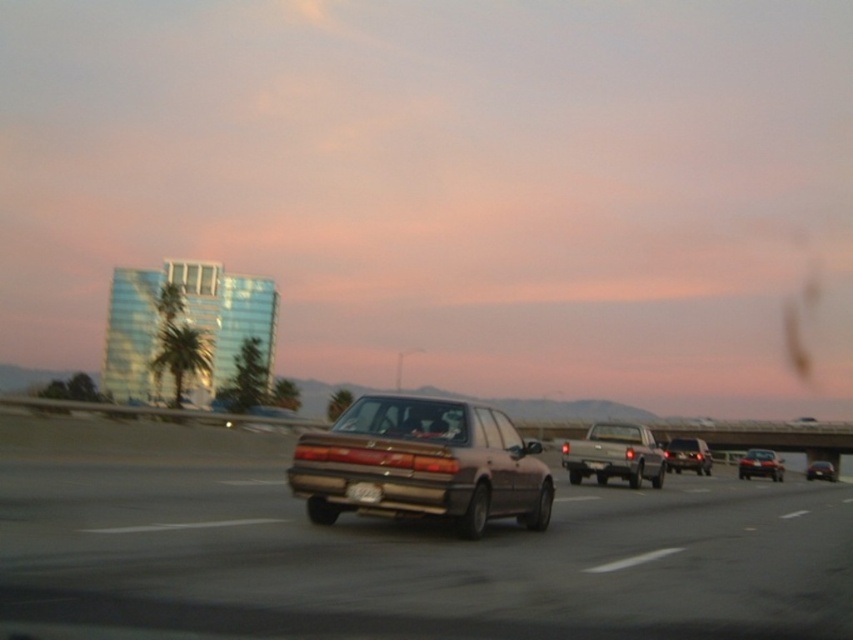
Can you confirm if green leafy palm tree at left is positioned below shiny silver sedan at lower right?

Incorrect, green leafy palm tree at left is not positioned below shiny silver sedan at lower right.

Image resolution: width=853 pixels, height=640 pixels. What do you see at coordinates (180, 355) in the screenshot? I see `green leafy palm tree at left` at bounding box center [180, 355].

Does point (184, 371) lie in front of point (762, 468)?

No, it is behind (762, 468).

Identify the location of green leafy palm tree at left. The image size is (853, 640). (180, 355).

From the picture: Is metallic brown car at center bigger than shiny silver sedan at lower right?

Actually, metallic brown car at center might be smaller than shiny silver sedan at lower right.

Does metallic brown car at center have a greater height compared to shiny silver sedan at lower right?

In fact, metallic brown car at center may be shorter than shiny silver sedan at lower right.

Find the location of a particular element. This screenshot has height=640, width=853. metallic brown car at center is located at coordinates (418, 561).

Is matte gray sedan at center wider than shiny silver sedan at lower right?

No, matte gray sedan at center is not wider than shiny silver sedan at lower right.

Who is more distant from viewer, (602, 484) or (761, 454)?

The point (761, 454) is more distant.

Which is in front, point (663, 456) or point (747, 460)?

Positioned in front is point (663, 456).

This screenshot has height=640, width=853. Find the location of `matte gray sedan at center`. matte gray sedan at center is located at coordinates (614, 454).